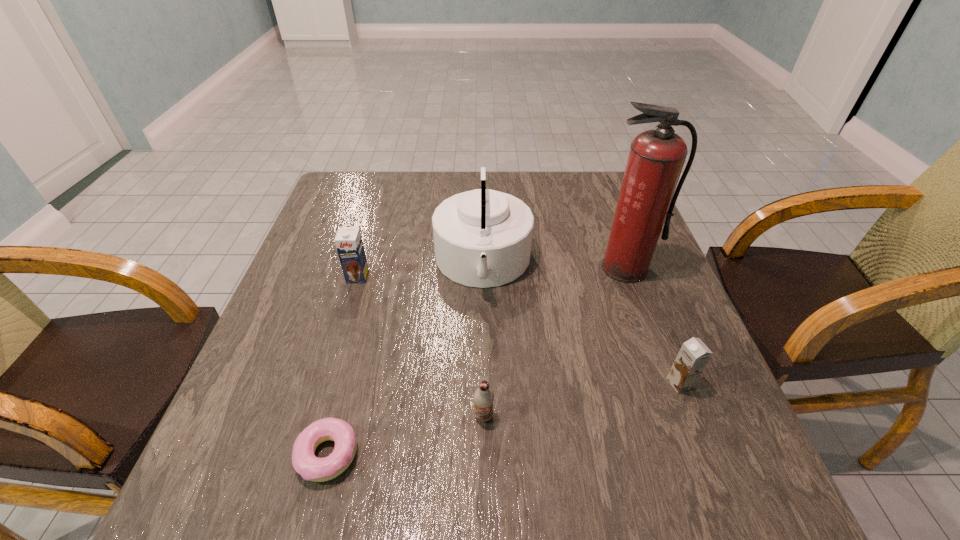
The height and width of the screenshot is (540, 960). Identify the location of vacant space that is in between the fire extinguisher and the second nearest object. (555, 342).

Find the location of a particular element. the second closest object to the rightmost chocolate milk is located at coordinates (482, 238).

Where is `the third closest object to the doughnut`? Image resolution: width=960 pixels, height=540 pixels. the third closest object to the doughnut is located at coordinates [x=348, y=241].

Choose which chocolate milk is the second nearest neighbor to the second nearest chocolate milk. Please provide its 2D coordinates. Your answer should be formatted as a tuple, i.e. [(x, y)], where the tuple contains the x and y coordinates of a point satisfying the conditions above.

[(348, 241)]

You are a GUI agent. You are given a task and a screenshot of the screen. Output one action in this format:
    pyautogui.click(x=<x>, y=<y>)
    Task: Click on the third closest chocolate milk to the shortest object
    Image resolution: width=960 pixels, height=540 pixels.
    Given the screenshot: What is the action you would take?
    point(694,355)

Image resolution: width=960 pixels, height=540 pixels. In order to click on free space that satisfies the following two spatial constraints: 1. on the front label of the doughnut; 2. on the left side of the leftmost chocolate milk in this screenshot , I will do `click(305, 455)`.

Identify the location of vacant space that satisfies the following two spatial constraints: 1. on the back side of the third nearest object; 2. on the spout of the kettle. Image resolution: width=960 pixels, height=540 pixels. (634, 264).

Where is `vacant position in the image that satisfies the following two spatial constraints: 1. on the spout of the kettle; 2. on the front label of the leftmost chocolate milk`? The width and height of the screenshot is (960, 540). vacant position in the image that satisfies the following two spatial constraints: 1. on the spout of the kettle; 2. on the front label of the leftmost chocolate milk is located at coordinates (483, 277).

Identify the location of free space that satisfies the following two spatial constraints: 1. at the nozzle of the second farthest chocolate milk; 2. on the left side of the tallest object. (667, 383).

The image size is (960, 540). I want to click on free space in the image that satisfies the following two spatial constraints: 1. on the back side of the shortest object; 2. on the left side of the second nearest object, so click(x=337, y=416).